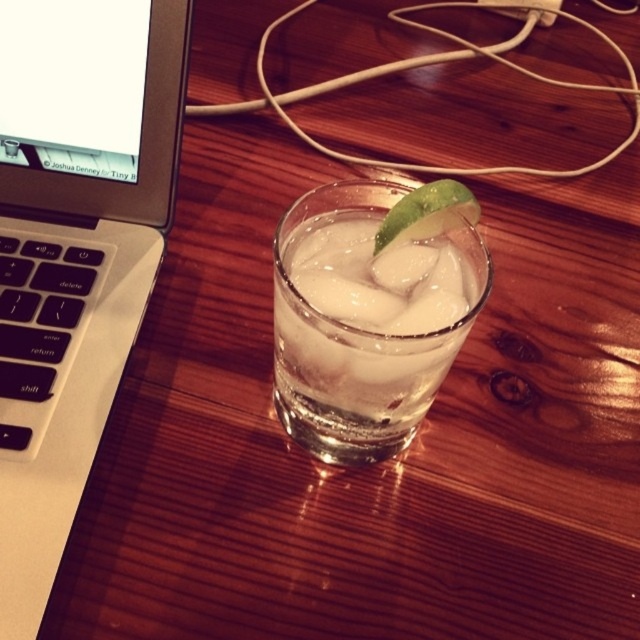
Question: Does clear glass ice at center have a larger size compared to green matte lime at center?

Choices:
 (A) no
 (B) yes

Answer: (B)

Question: Is clear glass ice at center smaller than green matte lime at center?

Choices:
 (A) no
 (B) yes

Answer: (A)

Question: Which point is farther from the camera taking this photo?

Choices:
 (A) (387, 237)
 (B) (13, 262)
 (C) (305, 401)

Answer: (B)

Question: Which object is positioned closest to the green matte lime at center?

Choices:
 (A) silver metallic laptop at left
 (B) clear glass ice at center

Answer: (B)

Question: Which object is positioned closest to the clear glass ice at center?

Choices:
 (A) silver metallic laptop at left
 (B) green matte lime at center

Answer: (B)

Question: Is clear glass ice at center in front of green matte lime at center?

Choices:
 (A) no
 (B) yes

Answer: (B)